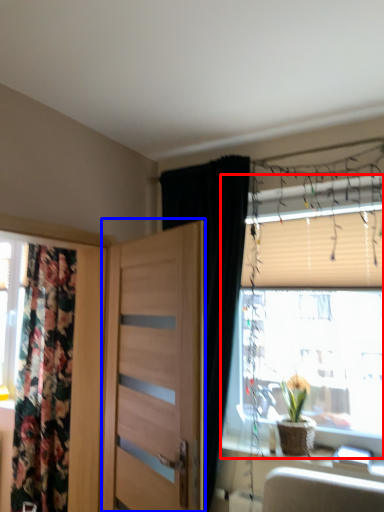
Question: Among these objects, which one is farthest to the camera, window (highlighted by a red box) or door (highlighted by a blue box)?

Choices:
 (A) window
 (B) door

Answer: (A)